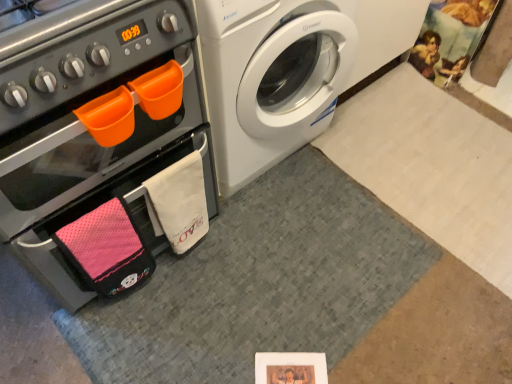
Question: Is matte black oven at left bigger or smaller than white glossy washing machine at upper right?

Choices:
 (A) big
 (B) small

Answer: (A)

Question: Is matte black oven at left in front of or behind white glossy washing machine at upper right in the image?

Choices:
 (A) behind
 (B) front

Answer: (B)

Question: Does point (30, 195) appear closer or farther from the camera than point (218, 71)?

Choices:
 (A) closer
 (B) farther

Answer: (A)

Question: Is white glossy washing machine at upper right bigger or smaller than matte black oven at left?

Choices:
 (A) big
 (B) small

Answer: (B)

Question: From a real-world perspective, is white glossy washing machine at upper right physically located above or below matte black oven at left?

Choices:
 (A) above
 (B) below

Answer: (B)

Question: Is white glossy washing machine at upper right to the left or to the right of matte black oven at left in the image?

Choices:
 (A) right
 (B) left

Answer: (A)

Question: Considering the positions of white glossy washing machine at upper right and matte black oven at left in the image, is white glossy washing machine at upper right wider or thinner than matte black oven at left?

Choices:
 (A) wide
 (B) thin

Answer: (A)